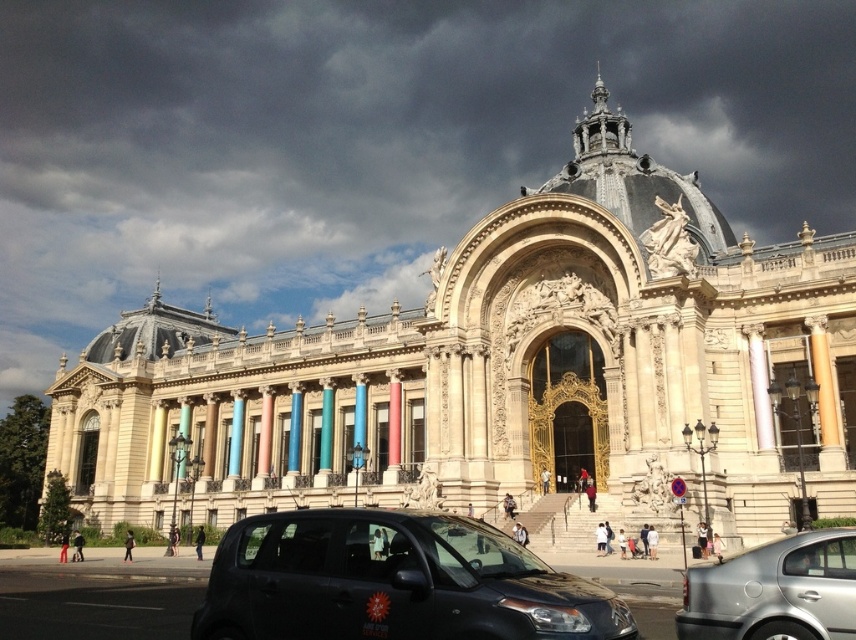
You are a tour guide leading a group to the entrance of the grand building. You notice both the black matte car at lower center and the silver metallic sedan at lower right are parked near the staircase. If you want to park your van, which is 2 meters wide, between them, will there be enough space?

The black matte car at lower center is wider than the silver metallic sedan at lower right. However, without knowing the exact distance between them or their individual widths, it is impossible to determine if there is sufficient space for a 2 meter wide van between them.

You are standing in front of the grand building and want to take a photo. You notice two points marked on the structure. Which point, point (x=382, y=561) or point (x=682, y=584), appears closer to you?

Point (x=382, y=561) is closer to the camera than point (x=682, y=584), so it will appear closer to you.

In the scene shown: You are standing at the entrance of the grand building and see the point marked as point 1 at coordinates (x=393, y=580). What object is located at that point?

The point 1 at coordinates (x=393, y=580) marks the location of the black matte car at lower center.